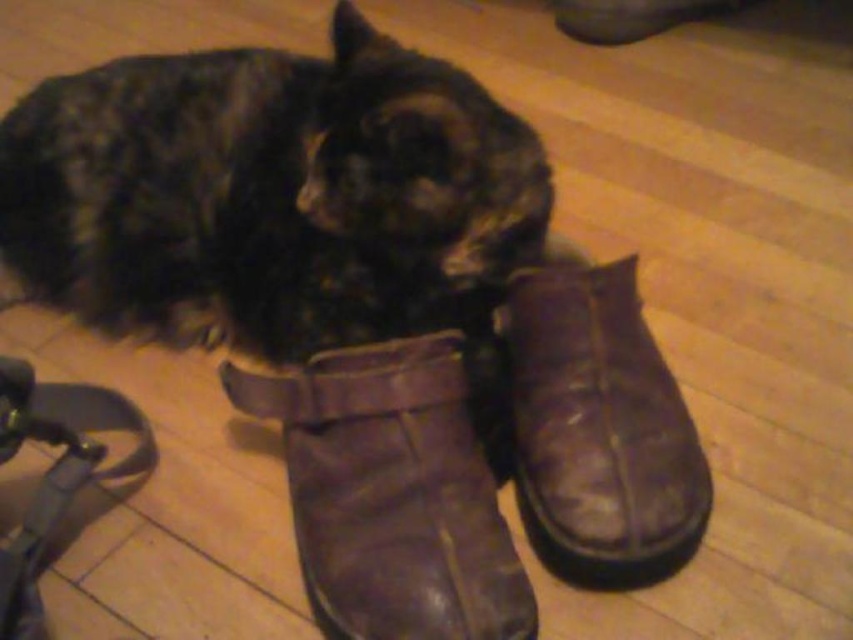
Question: Based on their relative distances, which object is nearer to the leather boot at lower center?

Choices:
 (A) leather boot at center
 (B) dark brown fur cat at center

Answer: (A)

Question: Among these points, which one is nearest to the camera?

Choices:
 (A) (698, 458)
 (B) (161, 118)

Answer: (A)

Question: Can you confirm if leather boot at center is positioned to the left of leather boot at lower center?

Choices:
 (A) yes
 (B) no

Answer: (A)

Question: Does dark brown fur cat at center appear under leather boot at lower center?

Choices:
 (A) no
 (B) yes

Answer: (A)

Question: Which point appears closest to the camera in this image?

Choices:
 (A) (312, 420)
 (B) (422, 326)

Answer: (A)

Question: Does leather boot at center appear under leather boot at lower center?

Choices:
 (A) yes
 (B) no

Answer: (A)